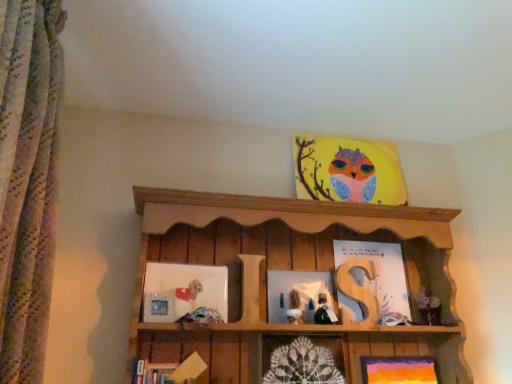
Question: Which is correct: matte glass picture frame at center, the 3th picture frame positioned from the bottom, is inside matte white picture frame at left, marked as the fifth picture frame in a bottom-to-top arrangement, or outside of it?

Choices:
 (A) inside
 (B) outside

Answer: (B)

Question: From the image's perspective, is matte glass picture frame at center, acting as the 4th picture frame starting from the top, located above or below matte white picture frame at left, marked as the fifth picture frame in a bottom-to-top arrangement?

Choices:
 (A) below
 (B) above

Answer: (A)

Question: Based on their relative distances, which object is nearer to the green glass bottle at center, the first toy viewed from the right?

Choices:
 (A) matte silver picture frame at lower left, positioned as the third picture frame in top-to-bottom order
 (B) wooden shelf at upper center
 (C) matte orange painting at lower right, the sixth picture frame from the top
 (D) matte glass picture frame at center, the 3th picture frame positioned from the bottom
 (E) matte paper owl at upper center, the sixth picture frame positioned from the bottom

Answer: (D)

Question: Which object is positioned farthest from the matte paper owl at upper center, which ranks as the 1th picture frame in top-to-bottom order?

Choices:
 (A) green glass bottle at center, the first toy viewed from the right
 (B) matte white picture frame at left, which is the second picture frame in top-to-bottom order
 (C) floral fabric curtain at left
 (D) matte silver picture frame at lower left, positioned as the third picture frame in top-to-bottom order
 (E) white fabric doll at center, placed as the second toy when sorted from right to left

Answer: (C)